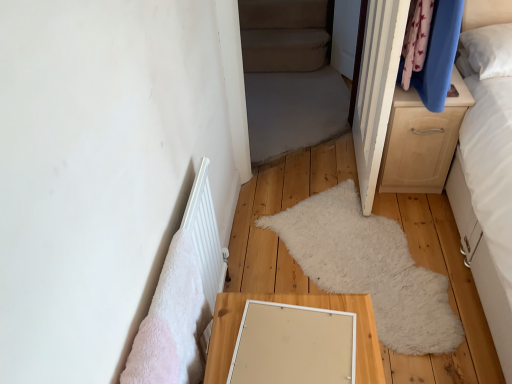
At what (x,y) coordinates should I click in order to perform the action: click on vacant space that is in between white wood door at upper right and beige fabric bed at center. Please return your answer as a coordinate pair (x, y). Image resolution: width=512 pixels, height=384 pixels. Looking at the image, I should click on (319, 176).